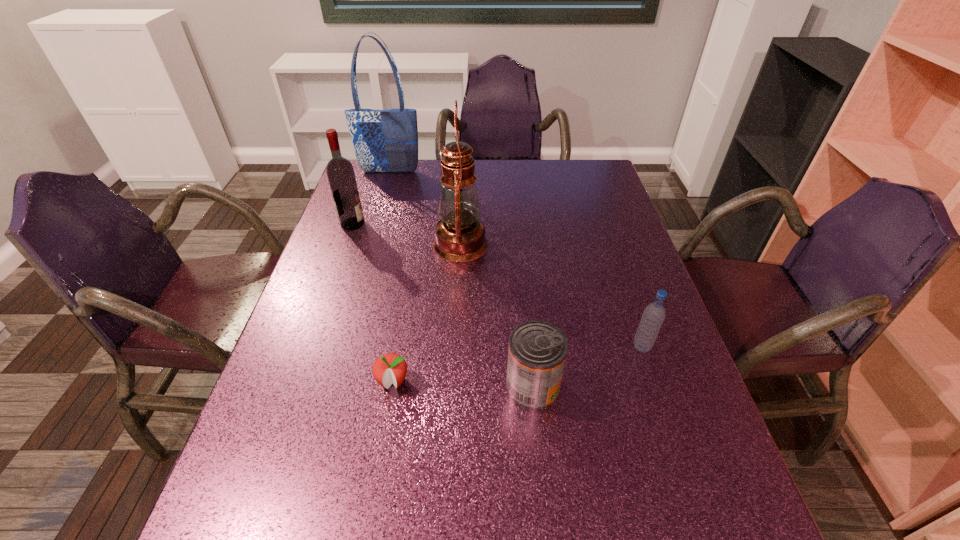
Identify the location of the farthest object. The width and height of the screenshot is (960, 540). (386, 140).

What are the coordinates of `oil lamp` in the screenshot? It's located at (460, 236).

Locate an element on the screen. This screenshot has width=960, height=540. alcohol is located at coordinates [340, 172].

The height and width of the screenshot is (540, 960). I want to click on the fourth tallest object, so click(653, 316).

In order to click on the rightmost object in this screenshot , I will do `click(653, 316)`.

Identify the location of the second shortest object. The width and height of the screenshot is (960, 540). (537, 352).

Identify the location of can. This screenshot has width=960, height=540. (537, 352).

Where is `the shortest object`? the shortest object is located at coordinates (391, 368).

Identify the location of free space located 0.360m on the front-facing side of the farthest object. The image size is (960, 540). (370, 240).

The image size is (960, 540). I want to click on free space located on the right of the third object from right to left, so pyautogui.click(x=581, y=244).